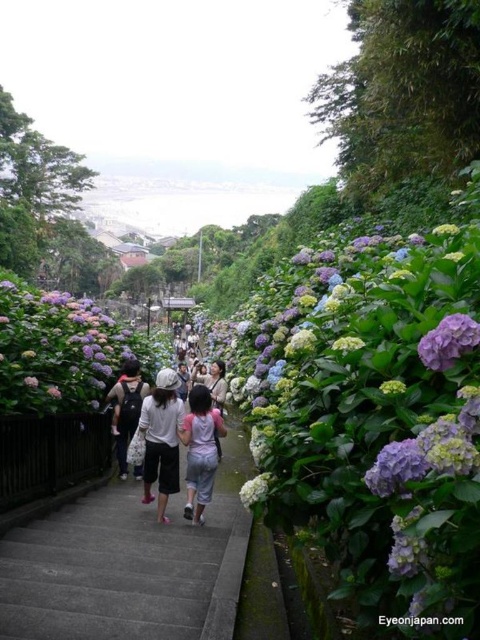
You are a photographer standing on the scenic pathway and want to capture a photo of the pink fabric dress at center and the purple matte hydrangea at right. Based on their positions, which object should you adjust your camera angle to focus on first if you want to include both in the frame?

The pink fabric dress at center is to the left of the purple matte hydrangea at right, so you should first focus on the pink fabric dress at center to ensure both objects are included in the frame.

You are standing at the entrance of the pathway and want to reach a specific point marked as point (46, 316). Given that the pathway is 200 feet long, can you safely walk the entire length of the pathway to reach that point?

The distance between point (46, 316) and the viewer is 190.27 feet, which is less than the pathway length of 200 feet. Therefore, you can safely walk the entire length of the pathway to reach that point.